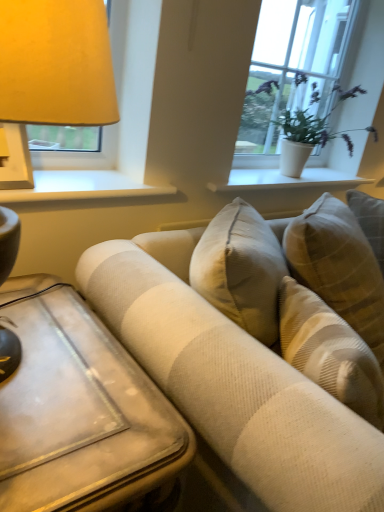
What are the coordinates of `wooden table at lower left` in the screenshot? It's located at (79, 410).

What do you see at coordinates (79, 410) in the screenshot? I see `wooden table at lower left` at bounding box center [79, 410].

This screenshot has height=512, width=384. I want to click on white textured plant at upper right, so click(291, 70).

The image size is (384, 512). Identify the location of beige textured couch at center. (234, 384).

The image size is (384, 512). Find the location of `white painted wood at upper left, the 2th window sill positioned from the back`. white painted wood at upper left, the 2th window sill positioned from the back is located at coordinates (82, 187).

Is wooden table at lower left located within beige textured couch at center?

That's incorrect, wooden table at lower left is not inside beige textured couch at center.

Considering the sizes of objects beige textured couch at center and wooden table at lower left in the image provided, who is smaller, beige textured couch at center or wooden table at lower left?

Smaller between the two is wooden table at lower left.

Between beige textured couch at center and wooden table at lower left, which one has less height?

With less height is wooden table at lower left.

Can you confirm if wooden table at lower left is positioned to the right of white textured plant at upper right?

In fact, wooden table at lower left is to the left of white textured plant at upper right.

Who is more distant, wooden table at lower left or white textured plant at upper right?

Positioned behind is white textured plant at upper right.

Does wooden table at lower left have a lesser width compared to white textured plant at upper right?

In fact, wooden table at lower left might be wider than white textured plant at upper right.

Is white textured plant at upper right surrounded by wooden table at lower left?

That's incorrect, white textured plant at upper right is not inside wooden table at lower left.

Does white textured plant at upper right have a greater height compared to beige textured couch at center?

Incorrect, the height of white textured plant at upper right is not larger of that of beige textured couch at center.

Between white textured plant at upper right and beige textured couch at center, which one appears on the right side from the viewer's perspective?

beige textured couch at center is more to the right.

How different are the orientations of white textured plant at upper right and beige textured couch at center in degrees?

0.798 degrees separate the facing orientations of white textured plant at upper right and beige textured couch at center.

Is white textured plant at upper right looking in the opposite direction of beige textured couch at center?

No, white textured plant at upper right's orientation is not away from beige textured couch at center.

From the image's perspective, which object appears higher, wooden table at lower left or white ceramic vase at upper center, which is the second window sill in left-to-right order?

white ceramic vase at upper center, which is the second window sill in left-to-right order.

Which point is more forward, (187, 451) or (214, 183)?

Point (187, 451)

From a real-world perspective, is wooden table at lower left located beneath white ceramic vase at upper center, the 2th window sill viewed from the front?

Yes.

Could you measure the distance between wooden table at lower left and white ceramic vase at upper center, the 2th window sill viewed from the front?

wooden table at lower left is 3.33 feet from white ceramic vase at upper center, the 2th window sill viewed from the front.

Considering the sizes of white painted wood at upper left, arranged as the first window sill when viewed from the left, and beige textured couch at center in the image, is white painted wood at upper left, arranged as the first window sill when viewed from the left, taller or shorter than beige textured couch at center?

In the image, white painted wood at upper left, arranged as the first window sill when viewed from the left, appears to be shorter than beige textured couch at center.

From the image's perspective, is white painted wood at upper left, which is the first window sill from front to back, under beige textured couch at center?

No.

Is beige textured couch at center placed right next to white textured plant at upper right?

No, beige textured couch at center is not beside white textured plant at upper right.

From the image's perspective, is beige textured couch at center located above or below white textured plant at upper right?

Based on their image positions, beige textured couch at center is located beneath white textured plant at upper right.

Can you confirm if beige textured couch at center is wider than white textured plant at upper right?

Indeed, beige textured couch at center has a greater width compared to white textured plant at upper right.

Is point (194, 377) farther from viewer compared to point (254, 53)?

No, (194, 377) is closer to viewer.

From the image's perspective, which one is positioned higher, wooden table at lower left or white painted wood at upper left, which is the first window sill from front to back?

white painted wood at upper left, which is the first window sill from front to back, appears higher in the image.

Can you confirm if wooden table at lower left is positioned to the right of white painted wood at upper left, the 2th window sill positioned from the back?

Yes.

Which is closer, (59, 463) or (62, 186)?

Positioned in front is point (59, 463).

Is wooden table at lower left positioned in front of white painted wood at upper left, arranged as the first window sill when viewed from the left?

Yes, it is in front of white painted wood at upper left, arranged as the first window sill when viewed from the left.

Identify the location of studio couch above the wooden table at lower left (from a real-world perspective). (234, 384).

At what (x,y) coordinates should I click in order to perform the action: click on window lying behind the wooden table at lower left. Please return your answer as a coordinate pair (x, y). Looking at the image, I should click on (291, 70).

Looking at the image, which one is located further to white textured plant at upper right, white painted wood at upper left, the 2th window sill positioned from the back, or beige textured couch at center?

Among the two, beige textured couch at center is located further to white textured plant at upper right.

Estimate the real-world distances between objects in this image. Which object is further from wooden table at lower left, white textured plant at upper right or beige textured couch at center?

Based on the image, white textured plant at upper right appears to be further to wooden table at lower left.

Looking at the image, which one is located further to beige textured couch at center, white ceramic vase at upper center, the 2th window sill viewed from the front, or wooden table at lower left?

Among the two, white ceramic vase at upper center, the 2th window sill viewed from the front, is located further to beige textured couch at center.

Which object lies further to the anchor point white ceramic vase at upper center, which appears as the 1th window sill when viewed from the right, white painted wood at upper left, the 2th window sill positioned from the back, or wooden table at lower left?

wooden table at lower left.

Which object lies further to the anchor point wooden table at lower left, white ceramic vase at upper center, marked as the first window sill in a back-to-front arrangement, or beige textured couch at center?

Based on the image, white ceramic vase at upper center, marked as the first window sill in a back-to-front arrangement, appears to be further to wooden table at lower left.

Looking at the image, which one is located further to white painted wood at upper left, arranged as the first window sill when viewed from the left, white ceramic vase at upper center, which is the second window sill in left-to-right order, or white textured plant at upper right?

white textured plant at upper right.

Based on their spatial positions, is wooden table at lower left or beige textured couch at center closer to white painted wood at upper left, which is the first window sill from front to back?

Among the two, beige textured couch at center is located nearer to white painted wood at upper left, which is the first window sill from front to back.

Considering their positions, is beige textured couch at center positioned closer to white textured plant at upper right than white painted wood at upper left, the 2th window sill when ordered from right to left?

white painted wood at upper left, the 2th window sill when ordered from right to left, lies closer to white textured plant at upper right than the other object.

The image size is (384, 512). Identify the location of table between beige textured couch at center and white ceramic vase at upper center, which appears as the 1th window sill when viewed from the right, in the front-back direction. tap(79, 410).

This screenshot has width=384, height=512. What are the coordinates of `window sill between wooden table at lower left and white ceramic vase at upper center, the 2th window sill viewed from the front, from front to back` in the screenshot? It's located at (82, 187).

Locate an element on the screen. window sill situated between white painted wood at upper left, the 2th window sill positioned from the back, and white textured plant at upper right from left to right is located at coordinates (285, 180).

At what (x,y) coordinates should I click in order to perform the action: click on studio couch between white textured plant at upper right and wooden table at lower left from top to bottom. Please return your answer as a coordinate pair (x, y). The image size is (384, 512). Looking at the image, I should click on (234, 384).